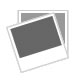
The width and height of the screenshot is (80, 80). Find the location of `gray picture on polaroid`. gray picture on polaroid is located at coordinates (42, 36).